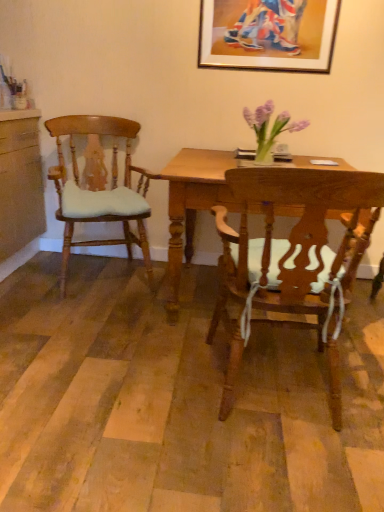
Question: Considering the relative sizes of wooden picture frame at upper center and wooden chair at center, the 1th chair when ordered from front to back, in the image provided, is wooden picture frame at upper center thinner than wooden chair at center, the 1th chair when ordered from front to back,?

Choices:
 (A) no
 (B) yes

Answer: (B)

Question: Considering the relative sizes of wooden picture frame at upper center and wooden chair at center, arranged as the second chair when viewed from the back, in the image provided, is wooden picture frame at upper center smaller than wooden chair at center, arranged as the second chair when viewed from the back,?

Choices:
 (A) yes
 (B) no

Answer: (A)

Question: Would you consider wooden picture frame at upper center to be distant from wooden chair at center, arranged as the second chair when viewed from the back?

Choices:
 (A) no
 (B) yes

Answer: (B)

Question: Is wooden picture frame at upper center to the left of wooden chair at center, the 1th chair when ordered from front to back, from the viewer's perspective?

Choices:
 (A) yes
 (B) no

Answer: (B)

Question: Could you tell me if wooden picture frame at upper center is turned towards wooden chair at center, the 1th chair when ordered from front to back?

Choices:
 (A) yes
 (B) no

Answer: (B)

Question: Considering the positions of point (269, 282) and point (193, 179), is point (269, 282) closer or farther from the camera than point (193, 179)?

Choices:
 (A) farther
 (B) closer

Answer: (B)

Question: Looking at their shapes, would you say wooden chair at center, marked as the 1th chair in a right-to-left arrangement, is wider or thinner than wooden desk at center?

Choices:
 (A) wide
 (B) thin

Answer: (B)

Question: From the image's perspective, is wooden chair at center, arranged as the second chair when viewed from the back, above or below wooden desk at center?

Choices:
 (A) below
 (B) above

Answer: (A)

Question: Considering the positions of wooden chair at center, placed as the second chair when sorted from left to right, and wooden desk at center in the image, is wooden chair at center, placed as the second chair when sorted from left to right, taller or shorter than wooden desk at center?

Choices:
 (A) tall
 (B) short

Answer: (A)

Question: From the image's perspective, is wooden chair at center, placed as the second chair when sorted from left to right, positioned above or below light brown wood chair at left, which appears as the first chair when viewed from the left?

Choices:
 (A) above
 (B) below

Answer: (B)

Question: Considering the positions of wooden chair at center, marked as the 1th chair in a right-to-left arrangement, and light brown wood chair at left, placed as the second chair when sorted from right to left, in the image, is wooden chair at center, marked as the 1th chair in a right-to-left arrangement, wider or thinner than light brown wood chair at left, placed as the second chair when sorted from right to left,?

Choices:
 (A) wide
 (B) thin

Answer: (B)

Question: Visually, is wooden chair at center, arranged as the second chair when viewed from the back, positioned to the left or to the right of light brown wood chair at left, placed as the second chair when sorted from right to left?

Choices:
 (A) right
 (B) left

Answer: (A)

Question: Is point (354, 198) closer or farther from the camera than point (137, 188)?

Choices:
 (A) closer
 (B) farther

Answer: (A)

Question: In the image, is wooden picture frame at upper center on the left side or the right side of wooden desk at center?

Choices:
 (A) left
 (B) right

Answer: (B)

Question: Is wooden picture frame at upper center taller or shorter than wooden desk at center?

Choices:
 (A) tall
 (B) short

Answer: (B)